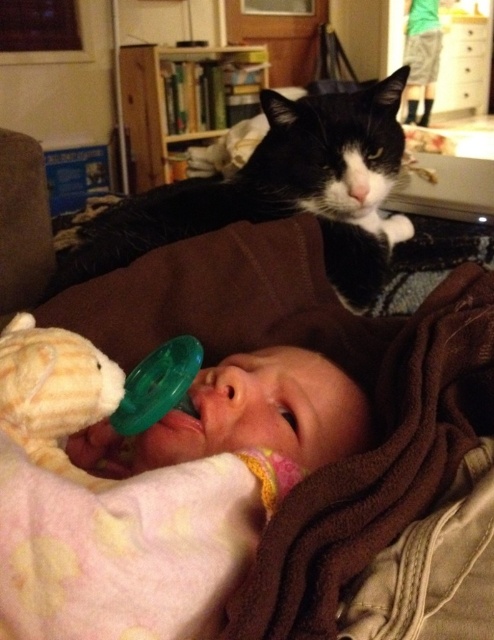
You are a parent trying to decide which item to pick up first between the pink soft fabric baby at center and the black fur cat at upper center. Which one is smaller and easier to hold?

The pink soft fabric baby at center is smaller than the black fur cat at upper center, so it is easier to hold.

You are a parent holding a 12 inch long baby toy. You want to place it between the pink soft fabric baby at center and the black fur cat at upper center so that both can see it. Is the space between them wide enough to fit the toy?

The distance between the pink soft fabric baby at center and the black fur cat at upper center is 18.15 inches, which is wider than the 12 inch long toy. Yes, the space is wide enough to place the toy between them so both can see it.